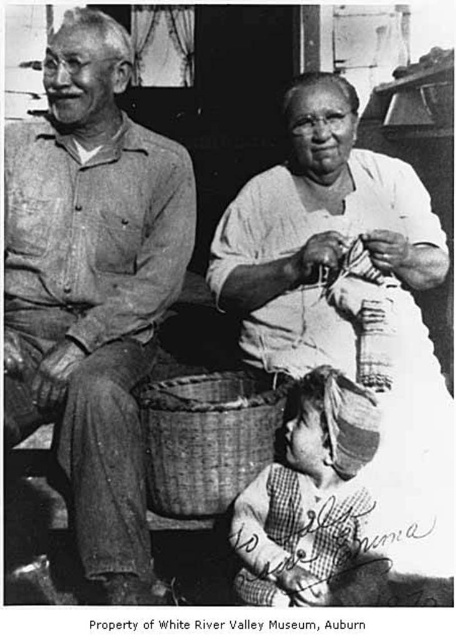
You are organizing a small picnic and need to decide between the plaid fabric dress at lower right and the woven bamboo basket at lower center to carry your snacks. Which item can hold more items?

The plaid fabric dress at lower right has a larger size compared to the woven bamboo basket at lower center, so it can hold more items.

You are standing at the camera position and want to know how far the point at coordinates point (x=316, y=280) is from you. Can you determine the distance?

The distance between point (x=316, y=280) and the camera is 8.58 feet.

You are standing 10 feet away from the point at coordinates point (300,394). Can you reach the point without moving closer?

The distance of point (300,394) from viewer is 7.57 feet, so you are currently 10 feet away. Since 10 feet is farther than 7.57 feet, you would need to move closer to reach the point.